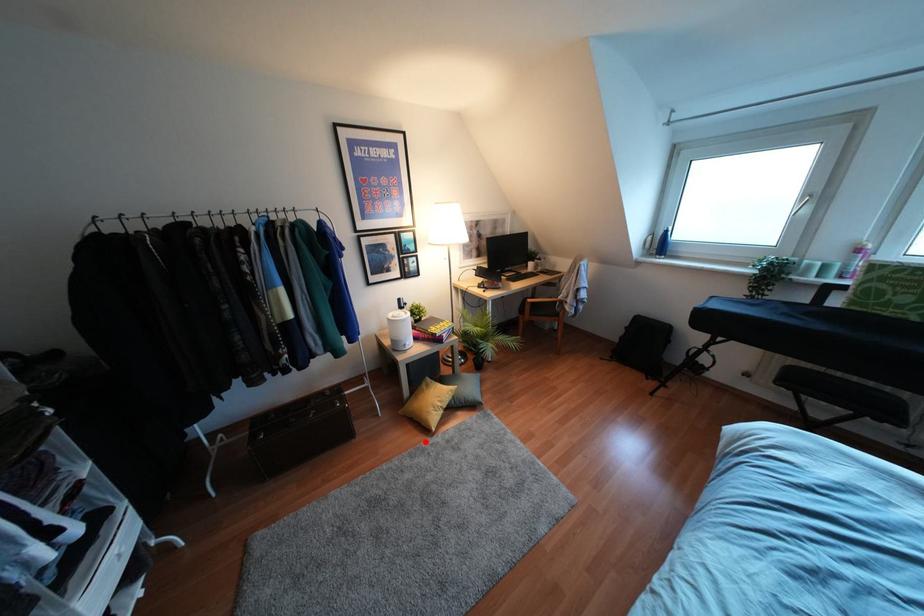
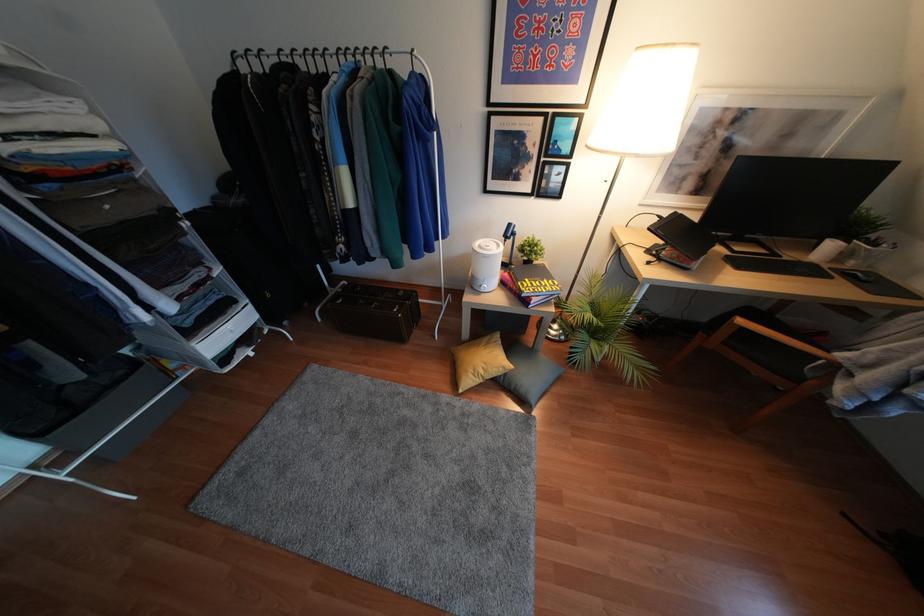
Question: A red point is marked in image1. In image2, is the corresponding 3D point closer to the camera or farther? Reply with the corresponding letter.

Choices:
 (A) The corresponding 3D point is closer.
 (B) The corresponding 3D point is farther.

Answer: (A)